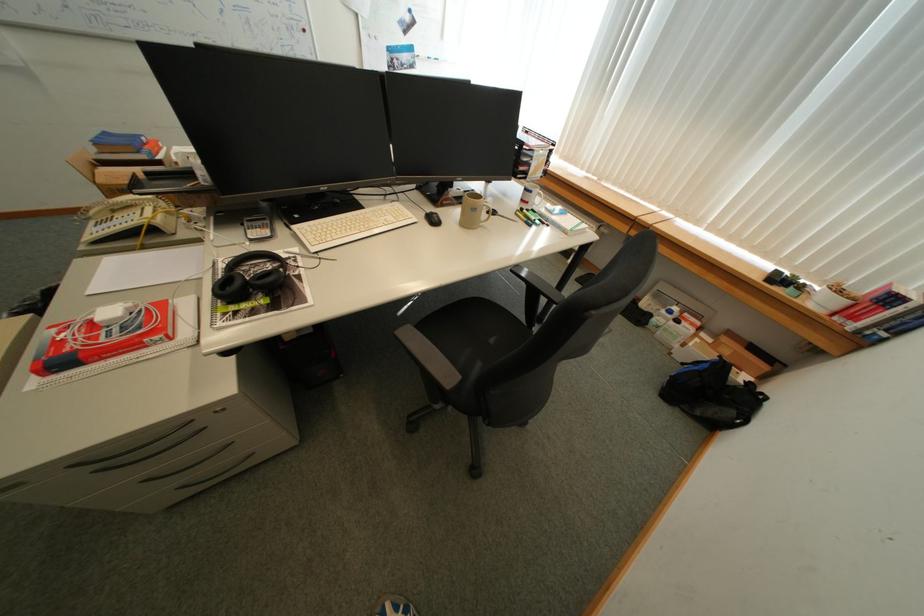
What do you see at coordinates (470, 217) in the screenshot?
I see `a beige mug handle` at bounding box center [470, 217].